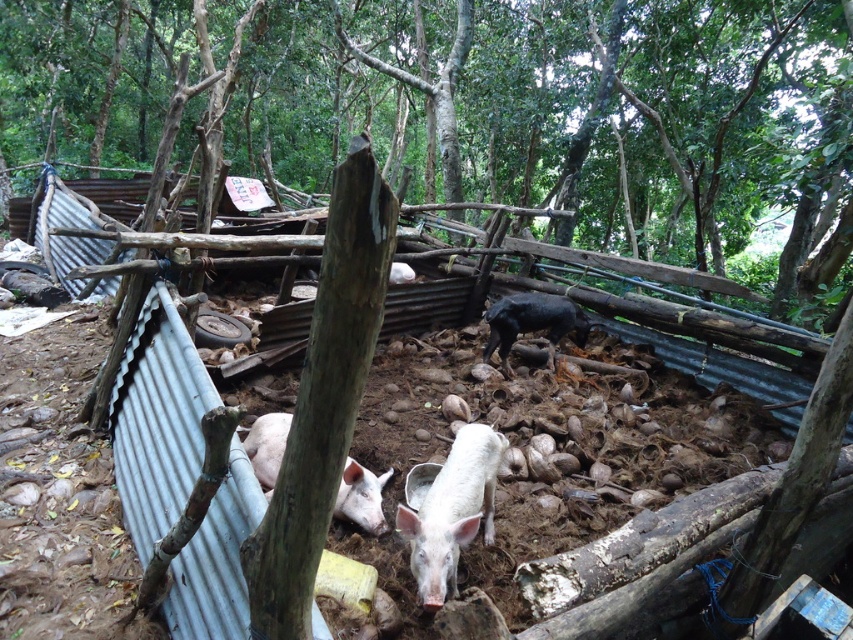
Question: Which object is closer to the camera taking this photo?

Choices:
 (A) shiny black pig at center
 (B) white matte pig at lower left
 (C) white matte pig at center
 (D) white matte mud at center

Answer: (C)

Question: Can you confirm if white matte mud at center is positioned above white matte pig at lower left?

Choices:
 (A) no
 (B) yes

Answer: (B)

Question: Can you confirm if white matte mud at center is thinner than white matte pig at center?

Choices:
 (A) no
 (B) yes

Answer: (A)

Question: Which point is farther to the camera?

Choices:
 (A) (525, 355)
 (B) (347, 515)
 (C) (422, 552)
 (D) (544, 314)

Answer: (A)

Question: Can you confirm if white matte mud at center is thinner than white matte pig at center?

Choices:
 (A) no
 (B) yes

Answer: (A)

Question: Which point is farther to the camera?

Choices:
 (A) shiny black pig at center
 (B) white matte pig at lower left
 (C) white matte mud at center

Answer: (A)